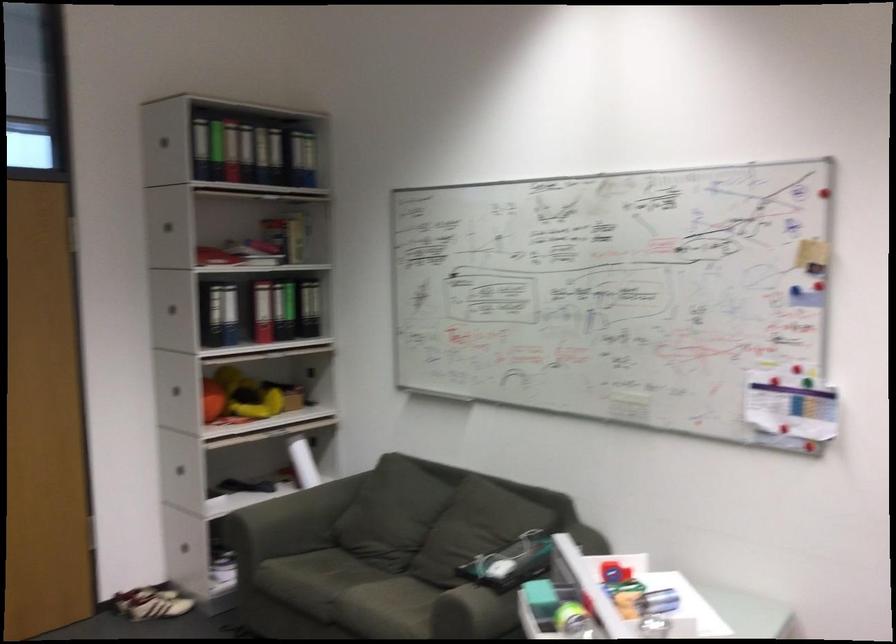
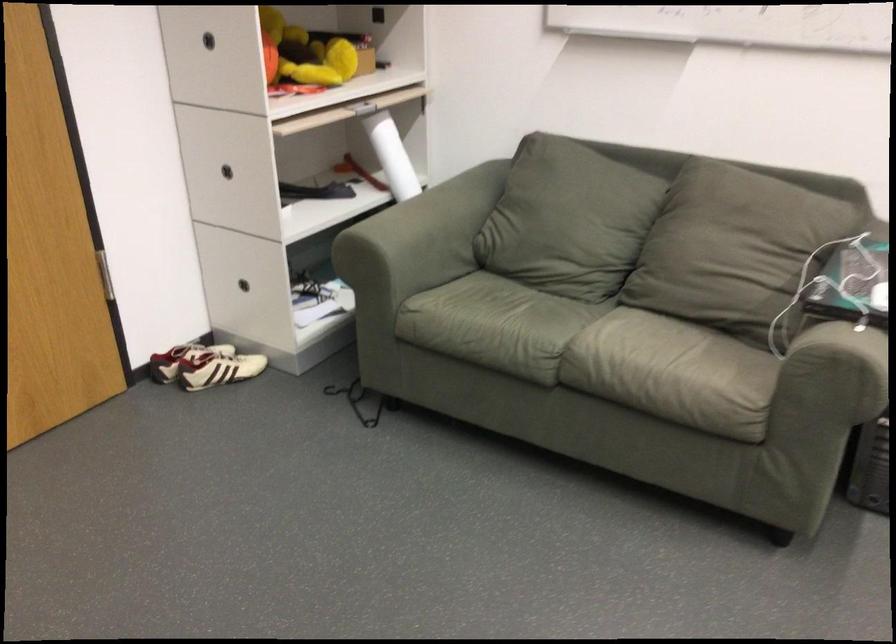
Locate, in the second image, the point that corresponds to point (271, 473) in the first image.

(330, 161)